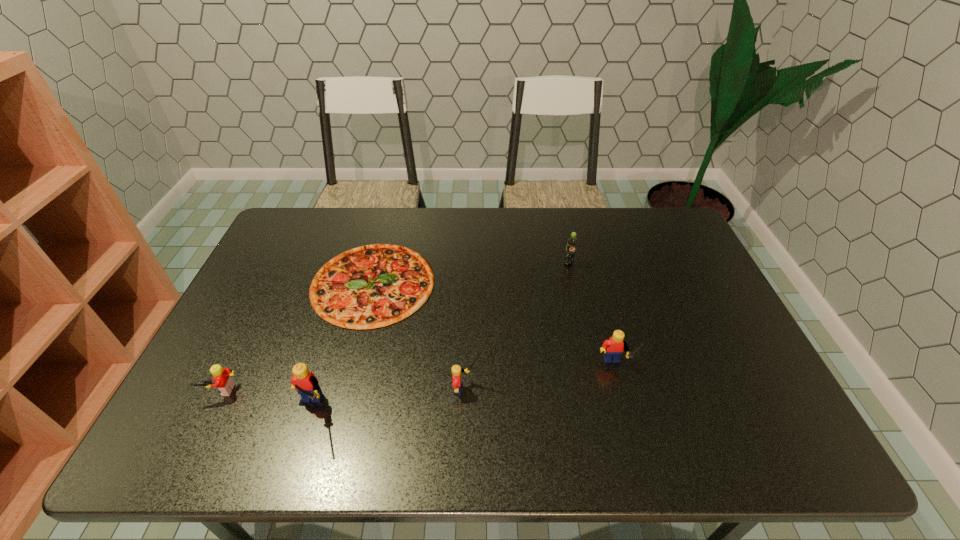
Find the location of a particular element. This screenshot has width=960, height=540. vacant area that lies between the second Lego from left to right and the leftmost Lego is located at coordinates (265, 401).

Locate an element on the screen. free point between the shortest object and the second shortest Lego is located at coordinates (420, 336).

This screenshot has height=540, width=960. I want to click on empty location between the third Lego from left to right and the soda, so click(x=518, y=326).

Identify the location of unoccupied area between the leftmost Lego and the second tallest Lego. Image resolution: width=960 pixels, height=540 pixels. (418, 380).

Find the location of a particular element. free space between the pizza and the third tallest Lego is located at coordinates (420, 336).

At what (x,y) coordinates should I click in order to perform the action: click on free space between the leftmost Lego and the second Lego from left to right. Please return your answer as a coordinate pair (x, y). This screenshot has height=540, width=960. Looking at the image, I should click on (265, 401).

The image size is (960, 540). I want to click on empty space between the third Lego from right to left and the shortest Lego, so click(x=265, y=401).

You are a GUI agent. You are given a task and a screenshot of the screen. Output one action in this format:
    pyautogui.click(x=<x>, y=<y>)
    Task: Click on the free space between the second Lego from right to left and the soda
    
    Given the screenshot: What is the action you would take?
    518,326

Identify the location of free area in between the shortest object and the soda. (470, 273).

Identify the location of blank region between the shortest object and the rightmost Lego. This screenshot has height=540, width=960. (493, 326).